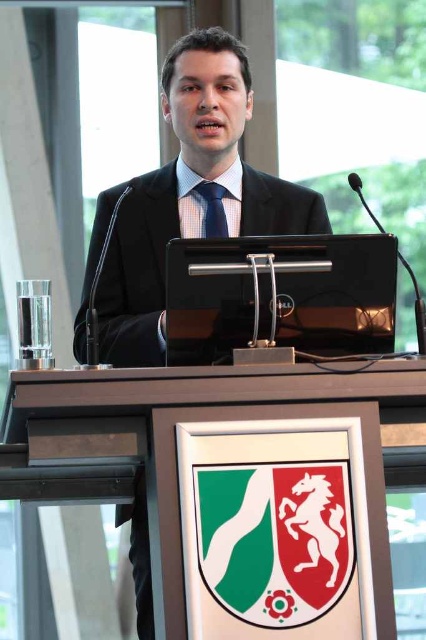
You are an event organizer who needs to ensure that the wooden podium at center and the blue textured tie at center are visible in a live stream. The camera can only focus on objects within a 1.5 meter width. Considering their sizes, will both objects fit within the camera frame?

The wooden podium at center is wider than the blue textured tie at center. Since the camera can only focus on objects within a 1.5 meter width, the podium may exceed the frame, making it impossible for both to be fully visible at the same time.

You are standing in front of the wooden podium at center and want to place a 4 feet long banner on the floor behind it. Is there enough space between you and the podium to do so?

The distance between you and the wooden podium at center is 4.65 feet, which is more than the required 4 feet, so there is enough space to place the banner.